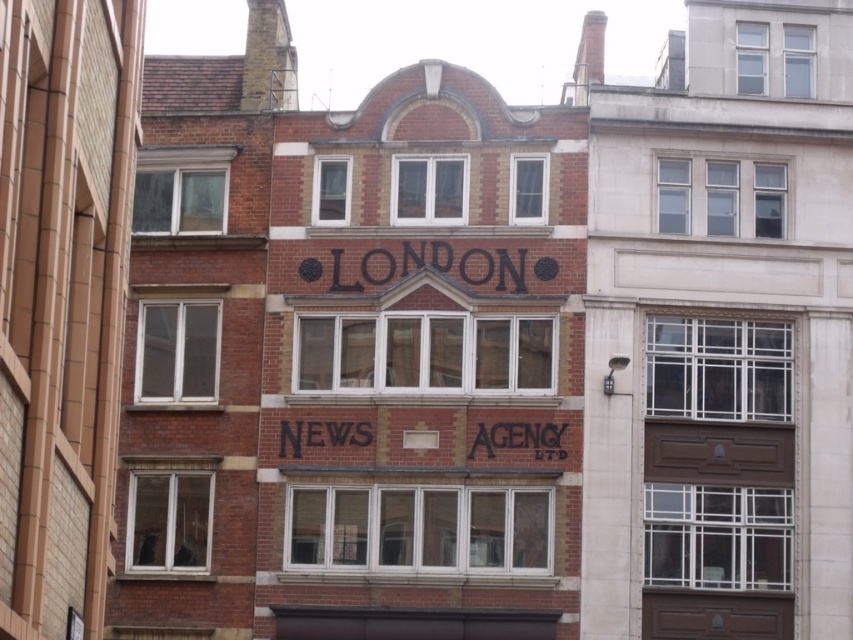
You are standing in front of the building and want to touch both the black painted letters at center and the black painted sign at center. Which one can you reach first without moving your position?

You can reach the black painted letters at center first because they are closer to you than the black painted sign at center.

Consider the image. You are an architect examining the building facade. You notice two black painted elements at the center of the scene. Which one is smaller in size between the black painted letters at center and the black painted sign at center?

The black painted letters at center are smaller in size compared to the black painted sign at center according to the description.